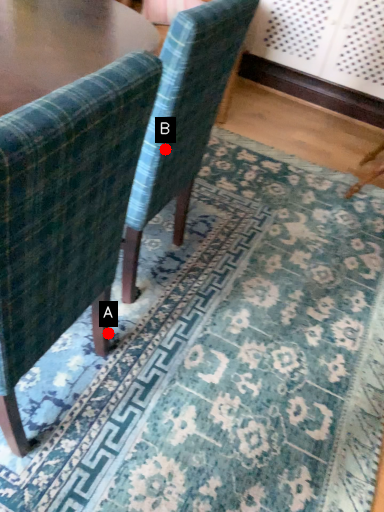
Question: Two points are circled on the image, labeled by A and B beside each circle. Among these points, which one is nearest to the camera?

Choices:
 (A) A is closer
 (B) B is closer

Answer: (B)